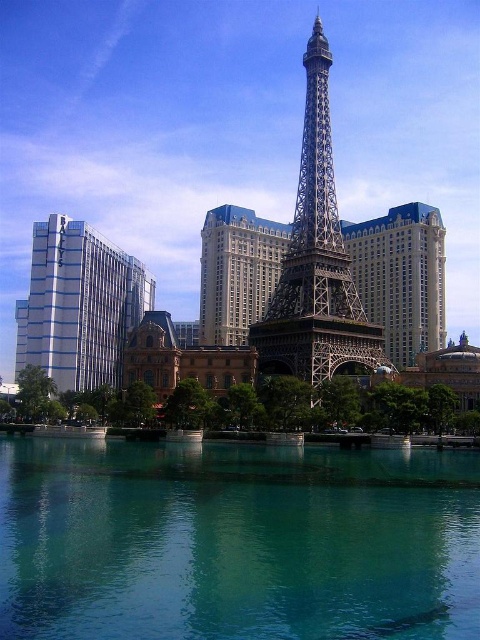
You are standing at the entrance of the Paris Las Vegas hotel and want to locate the teal glassy water at center. Based on the coordinates provided, in which direction should you look to find it?

The teal glassy water at center is located at coordinates point (236, 541), so you should look towards the center of the scene to find it.

You are a photographer planning to capture the teal glassy water at center and the metallic silver eiffel tower at center in a single shot. Based on their sizes, which object should you focus on to ensure both are clearly visible in the frame?

The teal glassy water at center has a smaller size compared to the metallic silver eiffel tower at center. To ensure both are clearly visible, focus on the metallic silver eiffel tower at center as it is larger and will remain in focus while the smaller teal glassy water at center will naturally fit into the frame without needing adjustment.